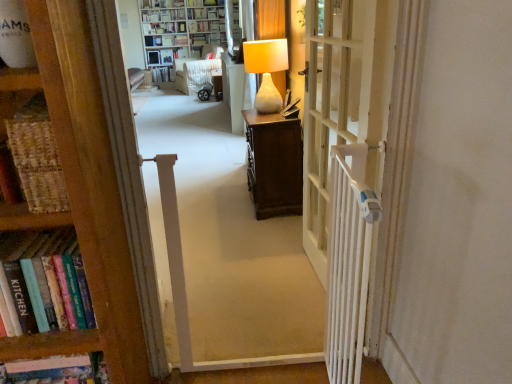
Question: Is matte white lamp at center to the left of hardcover book at upper center, the 1th book viewed from the top, from the viewer's perspective?

Choices:
 (A) yes
 (B) no

Answer: (B)

Question: From the image's perspective, is matte white lamp at center below hardcover book at upper center, arranged as the third book when ordered from the bottom?

Choices:
 (A) no
 (B) yes

Answer: (B)

Question: Can you see matte white lamp at center touching hardcover book at upper center, the 1th book viewed from the top?

Choices:
 (A) yes
 (B) no

Answer: (B)

Question: Does matte white lamp at center have a smaller size compared to hardcover book at upper center, arranged as the third book when ordered from the bottom?

Choices:
 (A) no
 (B) yes

Answer: (A)

Question: Does matte white lamp at center appear on the right side of hardcover book at upper center, the 1th book viewed from the top?

Choices:
 (A) no
 (B) yes

Answer: (B)

Question: Is matte white lamp at center inside the boundaries of matte white lamp at center, which is the first furniture in right-to-left order, or outside?

Choices:
 (A) outside
 (B) inside

Answer: (A)

Question: From a real-world perspective, is matte white lamp at center above or below matte white lamp at center, which is the first furniture in right-to-left order?

Choices:
 (A) above
 (B) below

Answer: (A)

Question: Considering the positions of matte white lamp at center and matte white lamp at center, which is the first furniture in right-to-left order, in the image, is matte white lamp at center taller or shorter than matte white lamp at center, which is the first furniture in right-to-left order,?

Choices:
 (A) short
 (B) tall

Answer: (A)

Question: Relative to matte white lamp at center, which is the first furniture in right-to-left order, is matte white lamp at center in front or behind?

Choices:
 (A) front
 (B) behind

Answer: (A)

Question: Would you say white wooden door at center is inside or outside hardcover book at center, which is the 3th book in top-to-bottom order?

Choices:
 (A) inside
 (B) outside

Answer: (B)

Question: Visually, is white wooden door at center positioned to the left or to the right of hardcover book at center, placed as the 1th book when sorted from bottom to top?

Choices:
 (A) left
 (B) right

Answer: (B)

Question: Is white wooden door at center taller or shorter than hardcover book at center, placed as the 1th book when sorted from bottom to top?

Choices:
 (A) short
 (B) tall

Answer: (B)

Question: Does point (378, 112) appear closer or farther from the camera than point (158, 67)?

Choices:
 (A) farther
 (B) closer

Answer: (B)

Question: Looking at their shapes, would you say white wooden door at center is wider or thinner than matte white shelf at upper center?

Choices:
 (A) wide
 (B) thin

Answer: (B)

Question: Looking at the image, does white wooden door at center seem bigger or smaller compared to matte white shelf at upper center?

Choices:
 (A) small
 (B) big

Answer: (B)